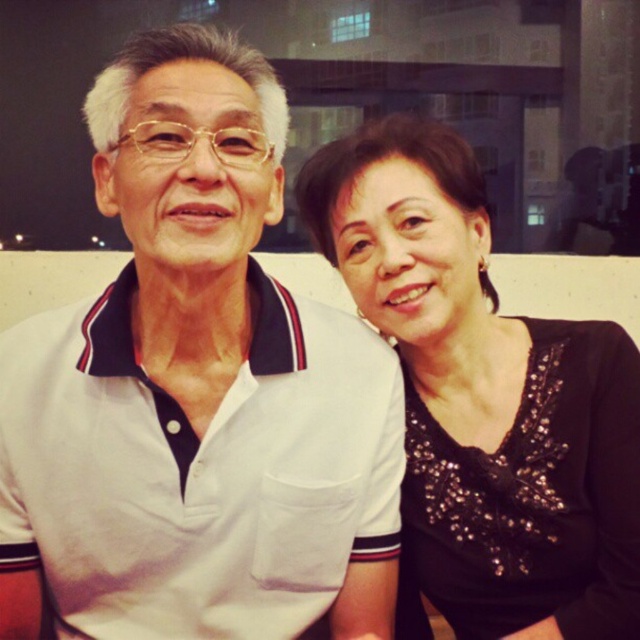
Question: Which point is closer to the camera taking this photo?

Choices:
 (A) (332, 620)
 (B) (408, 419)

Answer: (A)

Question: Does white cotton polo shirt at center have a greater width compared to black sequined blouse at right?

Choices:
 (A) no
 (B) yes

Answer: (B)

Question: Is white cotton polo shirt at center closer to the viewer compared to black sequined blouse at right?

Choices:
 (A) yes
 (B) no

Answer: (A)

Question: Is white cotton polo shirt at center positioned at the back of black sequined blouse at right?

Choices:
 (A) yes
 (B) no

Answer: (B)